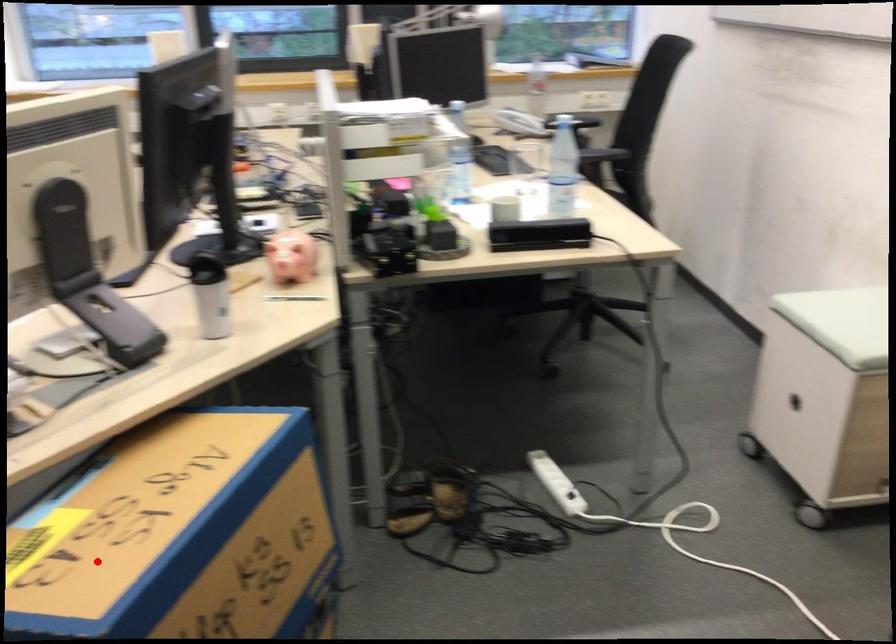
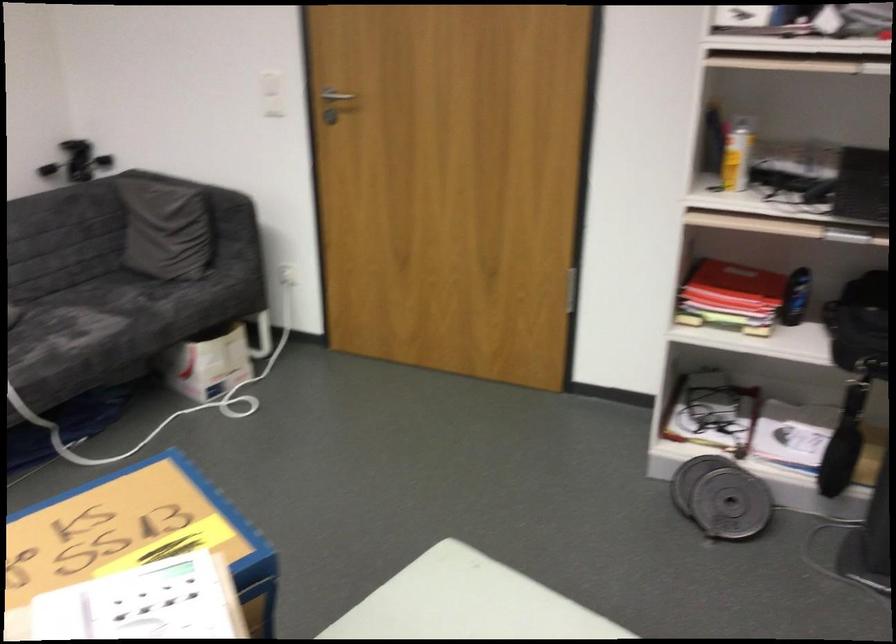
The point at the highlighted location is marked in the first image. Where is the corresponding point in the second image?

(139, 535)